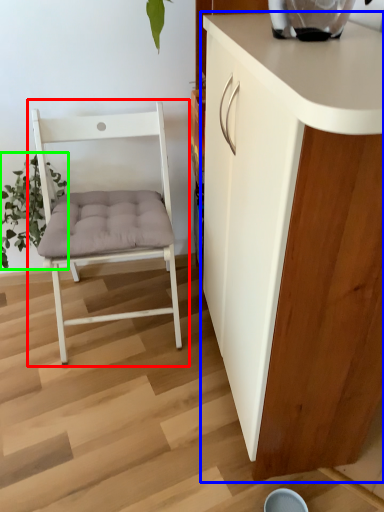
Question: Which is farther away from chair (highlighted by a red box)? cabinetry (highlighted by a blue box) or plant (highlighted by a green box)?

Choices:
 (A) cabinetry
 (B) plant

Answer: (A)